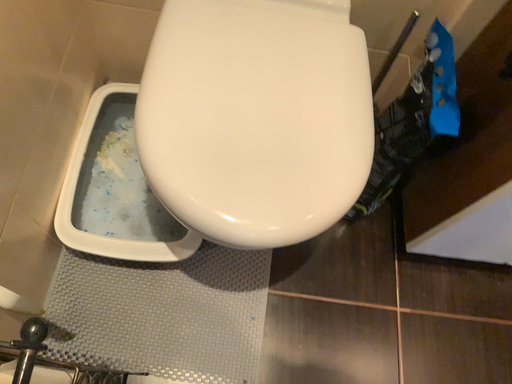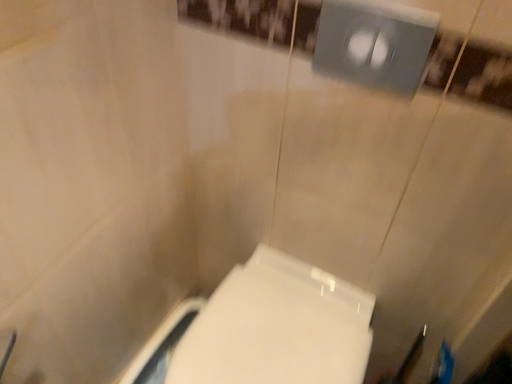
Question: How did the camera likely rotate when shooting the video?

Choices:
 (A) rotated upward
 (B) rotated downward

Answer: (A)